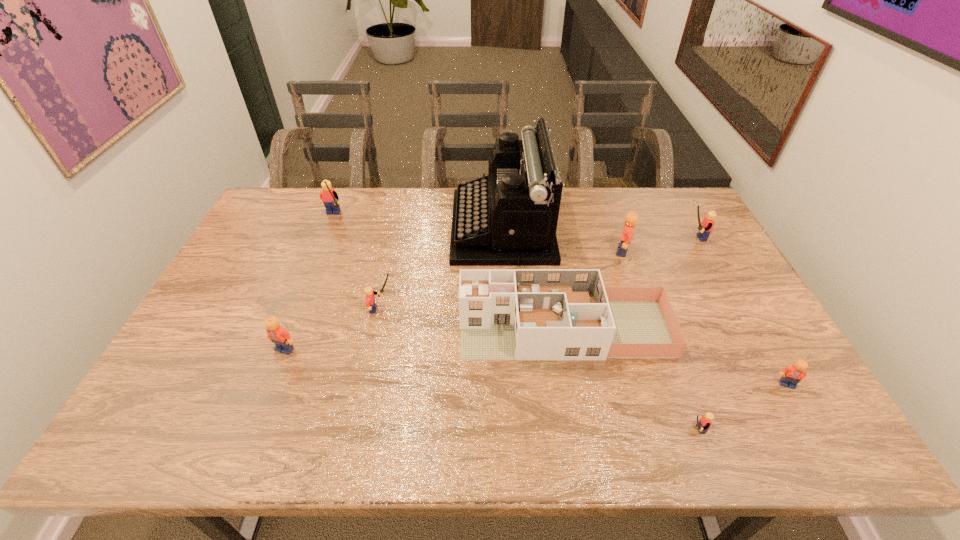
In the image, there is a desktop. Identify the location of vacant space at the near edge. (494, 435).

Locate an element on the screen. vacant space at the left edge is located at coordinates [x=164, y=376].

The image size is (960, 540). I want to click on free location at the right edge of the desktop, so click(749, 345).

Locate an element on the screen. free space at the far left corner of the desktop is located at coordinates (277, 216).

The width and height of the screenshot is (960, 540). What are the coordinates of `vacant space at the near left corner` in the screenshot? It's located at (138, 427).

In order to click on empty space that is in between the smallest yellow Lego and the second smallest orange Lego in this screenshot , I will do `click(489, 389)`.

Identify the location of empty space that is in between the biggest orange Lego and the leftmost orange Lego. Image resolution: width=960 pixels, height=540 pixels. (454, 300).

Where is `empty location between the black typewriter and the leftmost orange Lego`? empty location between the black typewriter and the leftmost orange Lego is located at coordinates (394, 288).

Find the location of a particular element. The height and width of the screenshot is (540, 960). unoccupied position between the nearest yellow Lego and the third Lego from left to right is located at coordinates (538, 369).

You are a GUI agent. You are given a task and a screenshot of the screen. Output one action in this format:
    pyautogui.click(x=<x>, y=<y>)
    Task: Click on the free space between the leftmost orange Lego and the smallest yellow Lego
    The height and width of the screenshot is (540, 960).
    Given the screenshot: What is the action you would take?
    pyautogui.click(x=489, y=389)